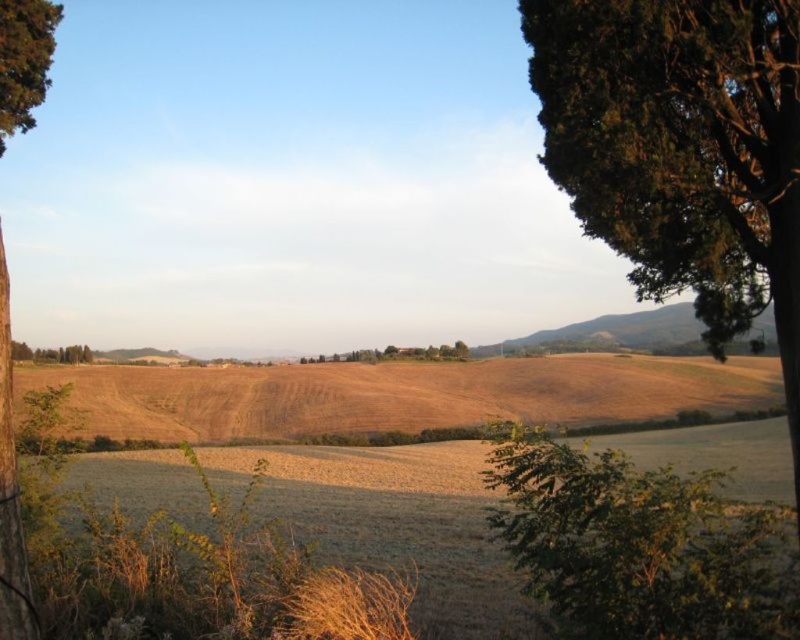
You are standing in the rural landscape scene and want to walk from the point closer to you to the point further away. Which path should you take between the two points, point (x=2, y=250) and point (x=16, y=38)?

You should walk from point (x=2, y=250) to point (x=16, y=38) because point (x=2, y=250) is closer to the camera and point (x=16, y=38) is further away.

You are standing in the middle of the rural landscape and notice two green leafy trees. Which tree, the green leafy tree at lower right or the green leafy tree at center, has a smaller trunk diameter?

The green leafy tree at lower right has a smaller trunk diameter than the green leafy tree at center.